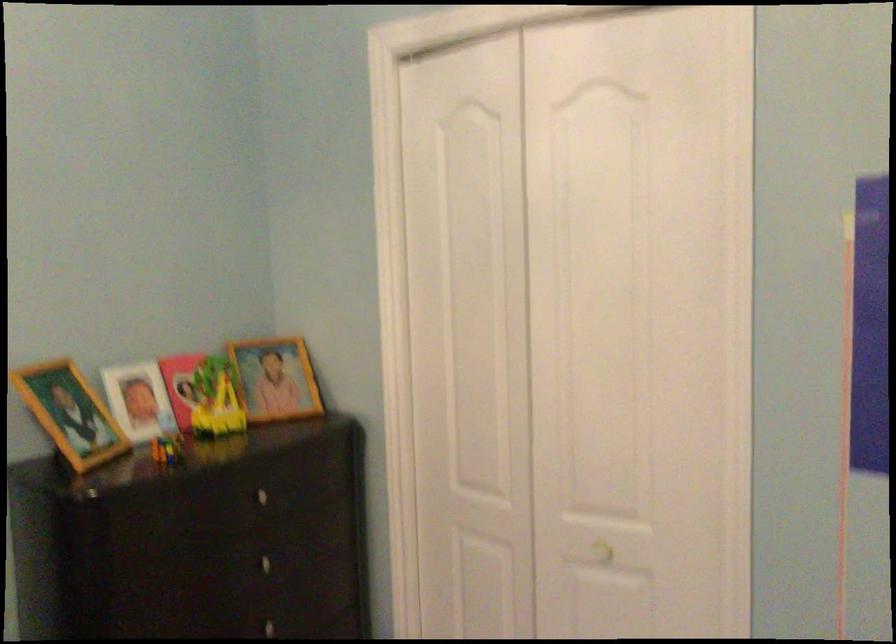
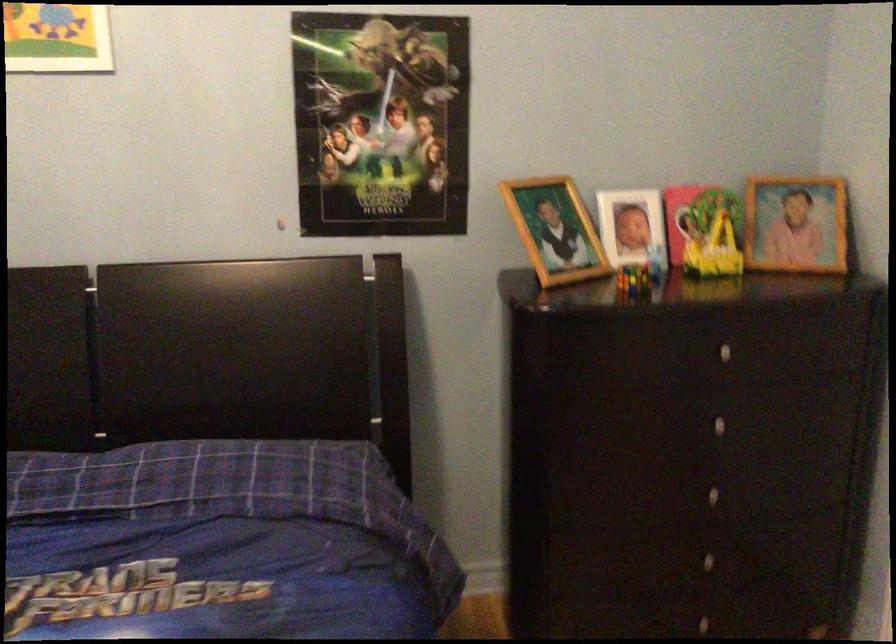
Find the pixel in the second image that matches [274,379] in the first image.

(796, 223)